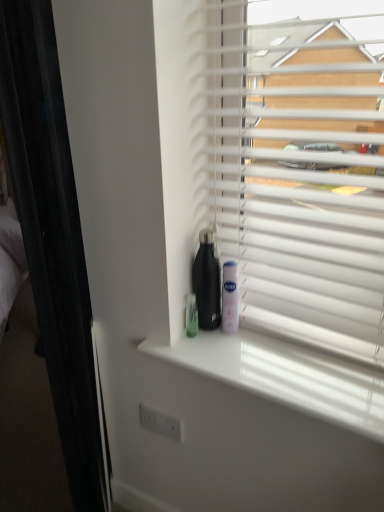
What are the coordinates of `free point above white glossy window sill at center (from a real-world perspective)` in the screenshot? It's located at (261, 361).